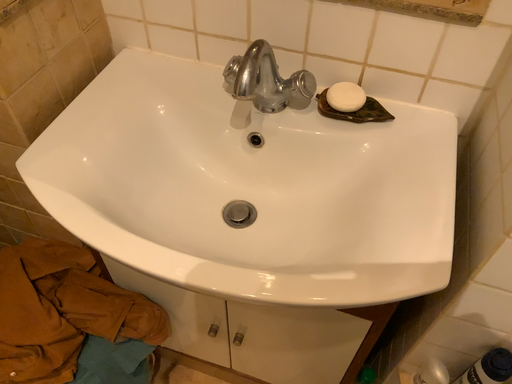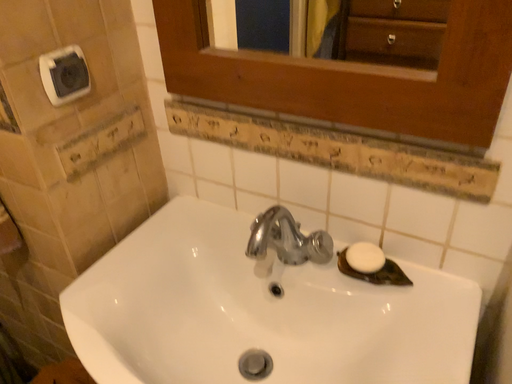
Question: How did the camera likely rotate when shooting the video?

Choices:
 (A) rotated upward
 (B) rotated downward

Answer: (A)